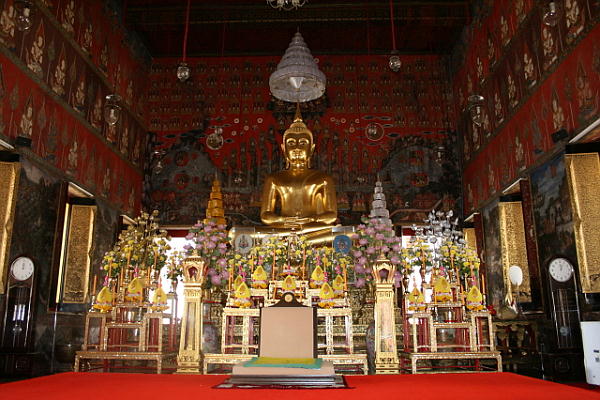
The image size is (600, 400). Find the location of `floor`. floor is located at coordinates (117, 383).